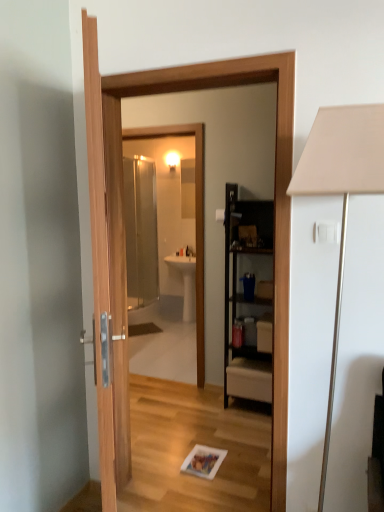
Locate an element on the screen. vacant area that lies in front of transparent glass mirror at center is located at coordinates (160, 401).